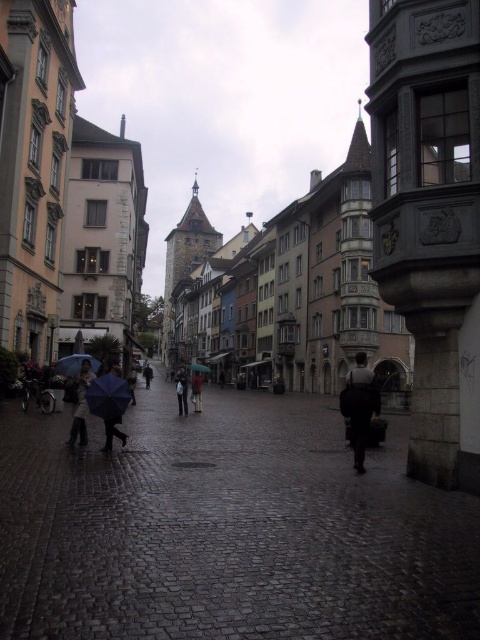
Question: Which object is farther from the camera taking this photo?

Choices:
 (A) matte black umbrella at center
 (B) light brown leather jacket at center
 (C) dark brown leather coat at lower left
 (D) dark brown leather jacket at center

Answer: (D)

Question: Does dark cobblestone street at center have a lesser width compared to light brown leather jacket at center?

Choices:
 (A) yes
 (B) no

Answer: (B)

Question: Does dark brown leather coat at lower left appear over blue matte umbrella at center?

Choices:
 (A) no
 (B) yes

Answer: (B)

Question: Which object appears farthest from the camera in this image?

Choices:
 (A) light brown leather jacket at center
 (B) dark brown leather jacket at center
 (C) dark cobblestone street at center
 (D) blue matte umbrella at lower left

Answer: (B)

Question: Can you confirm if dark gray fabric coat at center is wider than dark brown leather coat at lower left?

Choices:
 (A) no
 (B) yes

Answer: (B)

Question: Which point is farther to the camera?

Choices:
 (A) (377, 465)
 (B) (148, 368)
 (C) (195, 396)
 (D) (78, 369)

Answer: (B)